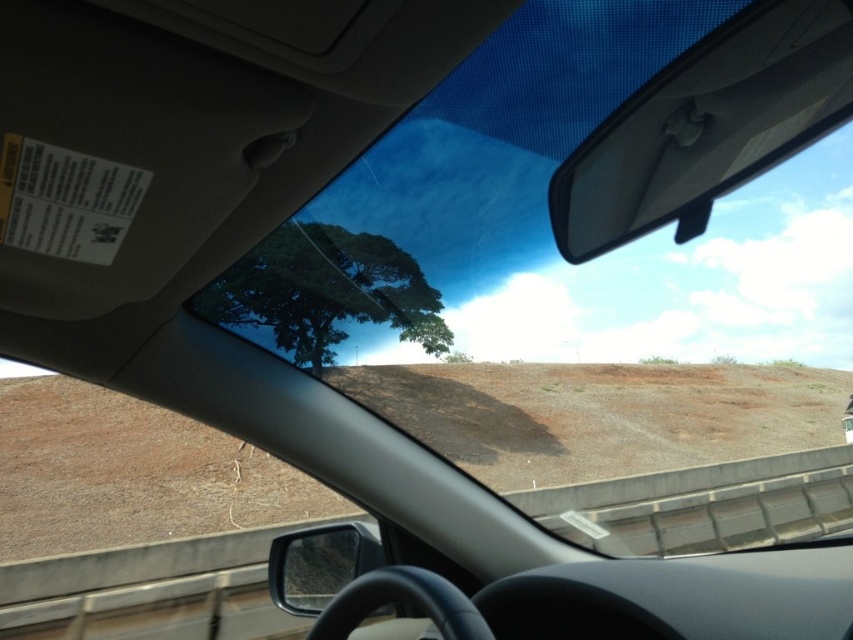
You are driving a car and need to check both the white plastic view mirror at upper center and the black plastic side mirror at lower center. Which mirror has a wider field of view?

The white plastic view mirror at upper center has a wider field of view because its width is larger than the black plastic side mirror at lower center.

You are driving a car and want to check your side mirror to see the green leafy tree at center. Can the white plastic view mirror at upper center show you the tree?

The white plastic view mirror at upper center is not as tall as the green leafy tree at center, so the mirror might not show the entire tree if it is positioned higher than the mirror.

You are driving a car and want to check your side mirror to see the green leafy tree at center. Can the white plastic view mirror at upper center show the entire tree?

The white plastic view mirror at upper center has a smaller size compared to green leafy tree at center, so it might not be able to show the entire tree in its reflection.